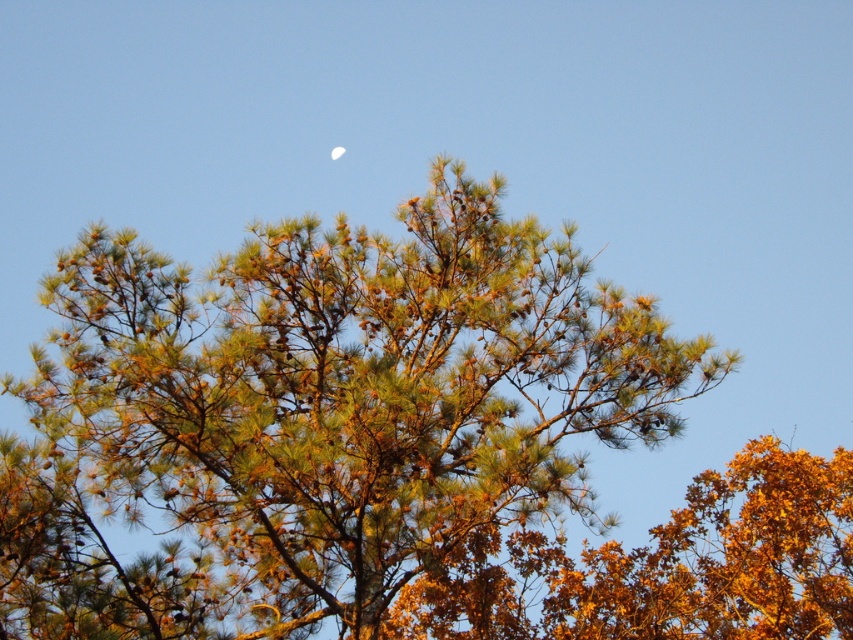
Measure the distance between green needle-like at center and white glossy moon at upper center.

green needle-like at center and white glossy moon at upper center are 17.58 feet apart.

What do you see at coordinates (316, 416) in the screenshot? I see `green needle-like at center` at bounding box center [316, 416].

The image size is (853, 640). What do you see at coordinates (316, 416) in the screenshot?
I see `green needle-like at center` at bounding box center [316, 416].

Find the location of a particular element. Image resolution: width=853 pixels, height=640 pixels. green needle-like at center is located at coordinates (316, 416).